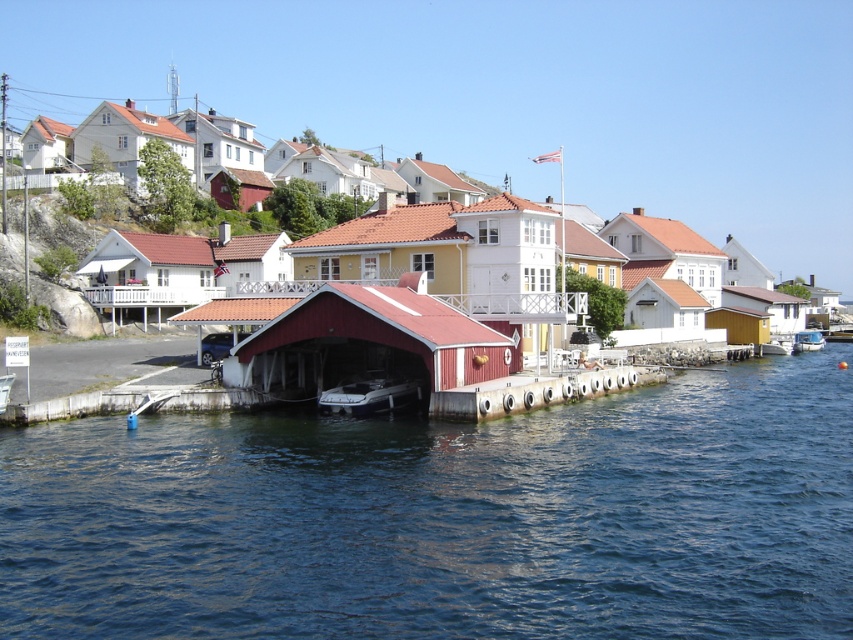
Question: Considering the real-world distances, which object is closest to the white wood cabin at center?

Choices:
 (A) white plastic boat at lower right
 (B) white wooden house at upper center

Answer: (A)

Question: Which of the following is the closest to the observer?

Choices:
 (A) blue water at lower center
 (B) white plastic boat at center
 (C) white plastic boat at lower left

Answer: (A)

Question: Does blue water at lower center appear on the right side of matte red wooden hut at center?

Choices:
 (A) yes
 (B) no

Answer: (A)

Question: Which point is farther from the camera taking this photo?

Choices:
 (A) click(457, 198)
 (B) click(762, 355)

Answer: (A)

Question: Observing the image, what is the correct spatial positioning of white wooden house at upper left in reference to white plastic boat at lower left?

Choices:
 (A) below
 (B) above

Answer: (B)

Question: Is blue water at lower center bigger than white wood house at upper center?

Choices:
 (A) yes
 (B) no

Answer: (B)